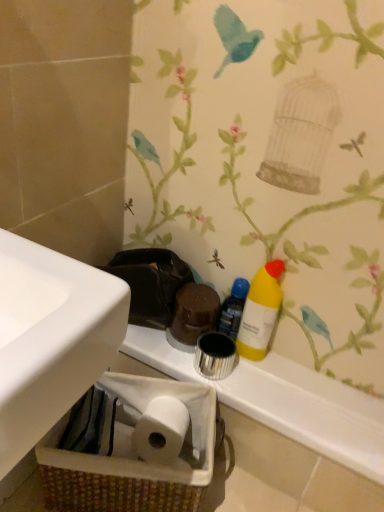
You are a GUI agent. You are given a task and a screenshot of the screen. Output one action in this format:
    pyautogui.click(x=<x>, y=<y>)
    Task: Click on the free location to the right of yellow matte bottle at center right
    
    Given the screenshot: What is the action you would take?
    point(315,377)